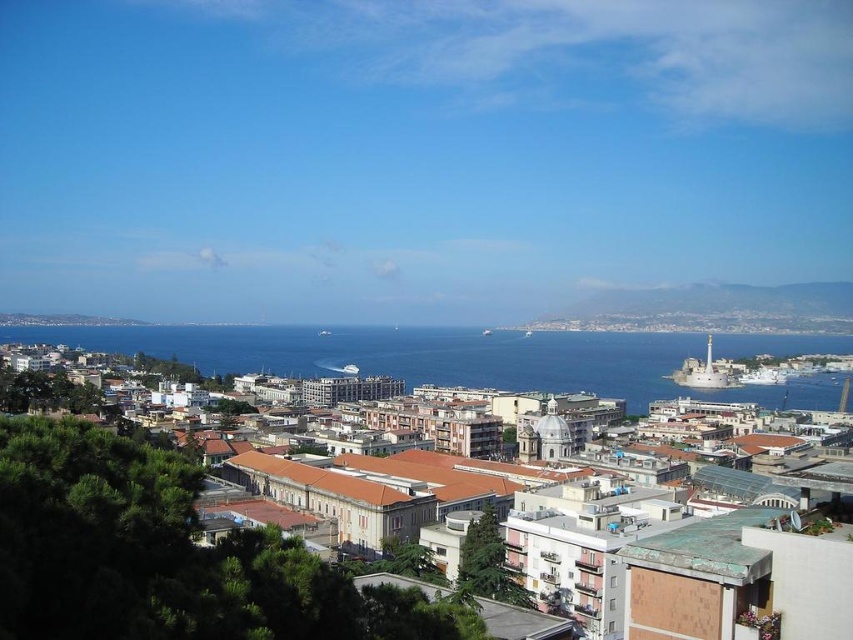
Between point (256, 344) and point (709, 387), which one is positioned behind?

The point (256, 344) is more distant.

How far apart are blue water at center and white glossy cruise ship at center-right?

A distance of 257.92 feet exists between blue water at center and white glossy cruise ship at center-right.

Is point (521, 356) less distant than point (682, 381)?

Yes, it is.

Where is `blue water at center`? Image resolution: width=853 pixels, height=640 pixels. blue water at center is located at coordinates (445, 358).

Between green grassy hillside at upper right and white glossy cruise ship at center-right, which one has more height?

green grassy hillside at upper right

Is point (585, 328) positioned in front of point (695, 378)?

No.

What do you see at coordinates (712, 308) in the screenshot? I see `green grassy hillside at upper right` at bounding box center [712, 308].

Locate an element on the screen. green grassy hillside at upper right is located at coordinates (712, 308).

Between blue water at center and green grassy hillside at upper right, which one appears on the right side from the viewer's perspective?

Positioned to the right is green grassy hillside at upper right.

Does blue water at center have a lesser height compared to green grassy hillside at upper right?

No.

Find the location of `blue water at center`. blue water at center is located at coordinates (445, 358).